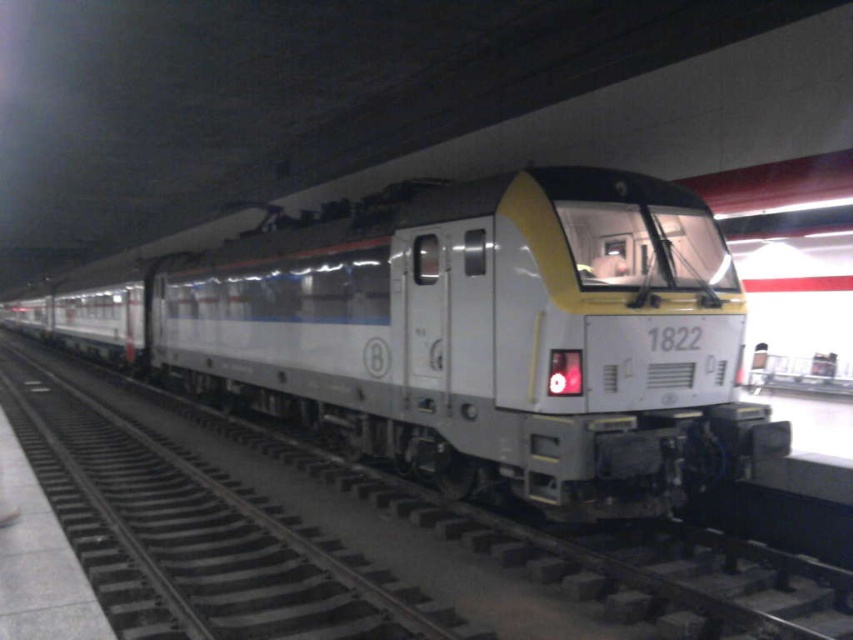
Does silver metallic train at center have a smaller size compared to metallic track at center?

No, silver metallic train at center is not smaller than metallic track at center.

Does silver metallic train at center appear on the right side of metallic track at center?

Yes, silver metallic train at center is to the right of metallic track at center.

Measure the distance between point [306,356] and camera.

Point [306,356] and camera are 10.61 meters apart from each other.

At what (x,y) coordinates should I click in order to perform the action: click on silver metallic train at center. Please return your answer as a coordinate pair (x, y). The width and height of the screenshot is (853, 640). Looking at the image, I should click on (467, 337).